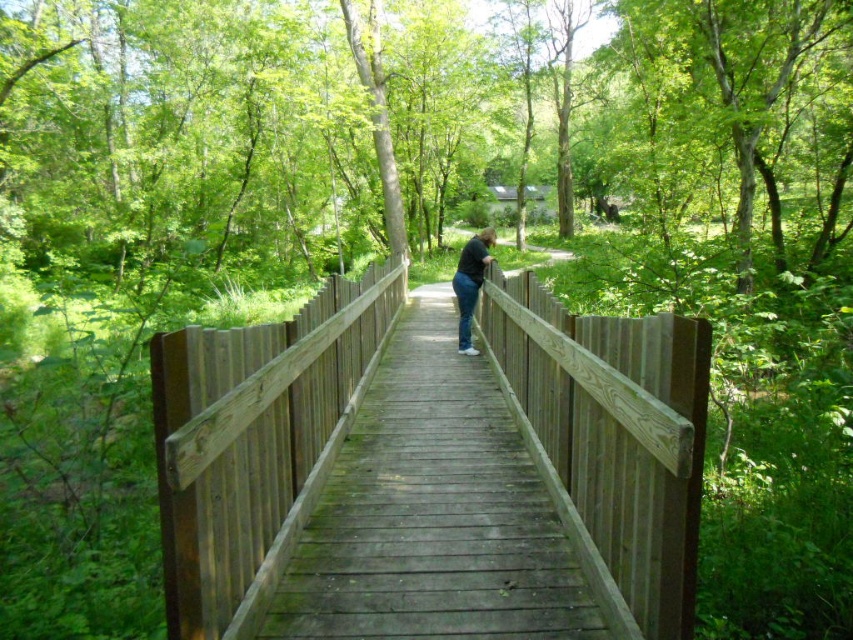
Is point (242, 470) positioned behind point (469, 284)?

No, (242, 470) is closer to viewer.

Looking at this image, is wooden bridge at center smaller than dark blue jeans at center?

Yes, wooden bridge at center is smaller than dark blue jeans at center.

What do you see at coordinates (256, 442) in the screenshot?
I see `wooden bridge at center` at bounding box center [256, 442].

At what (x,y) coordinates should I click in order to perform the action: click on wooden bridge at center. Please return your answer as a coordinate pair (x, y). This screenshot has height=640, width=853. Looking at the image, I should click on (256, 442).